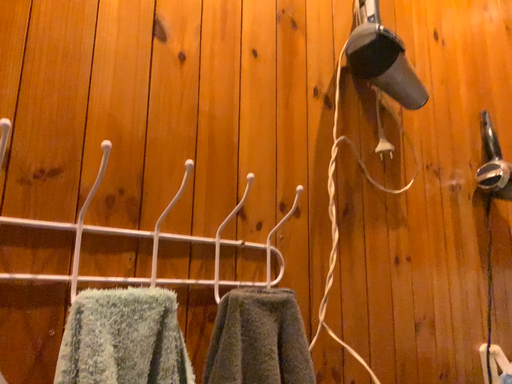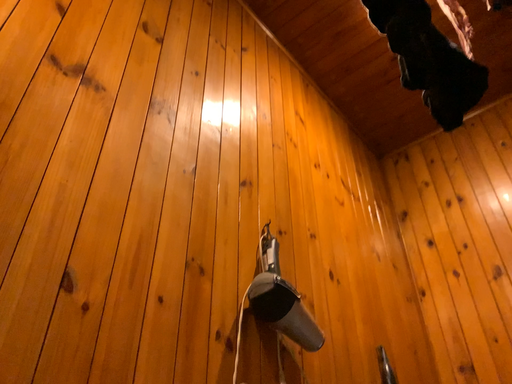
Question: Which way did the camera rotate in the video?

Choices:
 (A) rotated downward
 (B) rotated upward

Answer: (B)